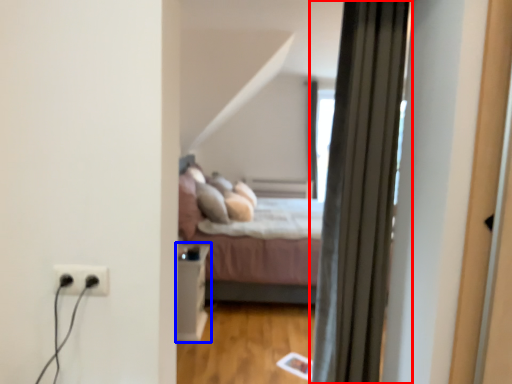
Question: Which of the following is the closest to the observer, curtain (highlighted by a red box) or table (highlighted by a blue box)?

Choices:
 (A) curtain
 (B) table

Answer: (A)